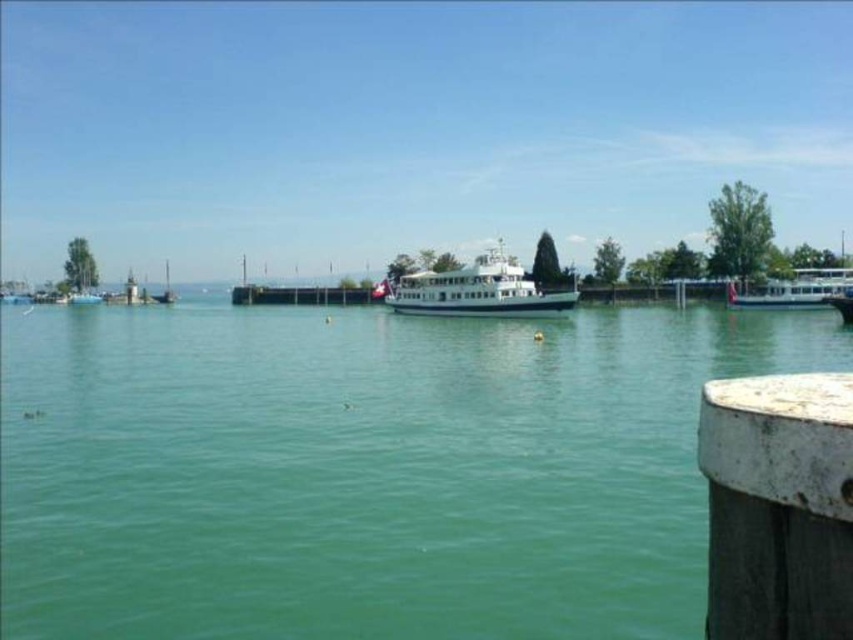
You are standing at the waterfront and want to take a photo of the white glossy boat at right. Your camera has a maximum zoom range of 100 feet. Can you capture the boat clearly without moving closer?

The white glossy boat at right is 185.65 feet away from you. Since your camera can only zoom up to 100 feet, you cannot capture the boat clearly without moving closer.

You are standing at the waterfront and want to determine which of the two points, point (840,538) or point (171,289), is closer to you. Based on the scene, can you identify which point is nearer?

Point (840,538) is closer to the viewer than point (171,289).

You are standing on the pier and see the white glossy boat at right and the white glossy sailboat at left. Which boat is closer to you?

The white glossy boat at right is closer to you because it is in front of the white glossy sailboat at left.